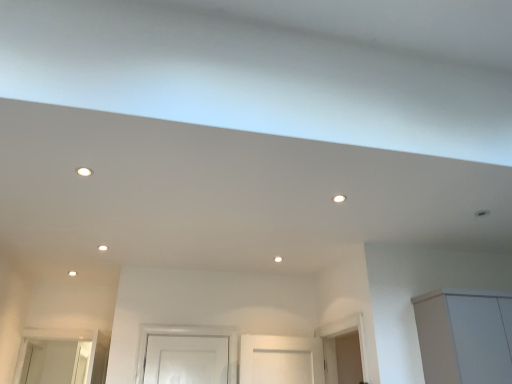
Question: From a real-world perspective, is white glossy light fixture at upper left, the second lighting in the bottom-to-top sequence, over matte white light fixture at center, which ranks as the 1th lighting in back-to-front order?

Choices:
 (A) no
 (B) yes

Answer: (B)

Question: Can you confirm if white glossy light fixture at upper left, which appears as the 1th lighting when viewed from the front, is taller than matte white light fixture at center, which is the 1th lighting from right to left?

Choices:
 (A) yes
 (B) no

Answer: (B)

Question: Does white glossy light fixture at upper left, marked as the first lighting in a top-to-bottom arrangement, lie behind matte white light fixture at center, positioned as the first lighting in bottom-to-top order?

Choices:
 (A) yes
 (B) no

Answer: (B)

Question: From a real-world perspective, is white glossy light fixture at upper left, which appears as the 1th lighting when viewed from the front, beneath matte white light fixture at center, the second lighting viewed from the top?

Choices:
 (A) yes
 (B) no

Answer: (B)

Question: Can you confirm if white glossy light fixture at upper left, which appears as the 1th lighting when viewed from the front, is shorter than matte white light fixture at center, which is the 2th lighting in front-to-back order?

Choices:
 (A) yes
 (B) no

Answer: (A)

Question: Can you confirm if white glossy light fixture at upper left, marked as the first lighting in a top-to-bottom arrangement, is wider than matte white light fixture at center, which is the 2th lighting in front-to-back order?

Choices:
 (A) no
 (B) yes

Answer: (B)

Question: From a real-world perspective, is matte white light fixture at center, which is the 1th lighting from right to left, on top of white matte cabinet at lower right?

Choices:
 (A) no
 (B) yes

Answer: (B)

Question: From the image's perspective, is matte white light fixture at center, positioned as the first lighting in bottom-to-top order, located beneath white matte cabinet at lower right?

Choices:
 (A) no
 (B) yes

Answer: (A)

Question: Is matte white light fixture at center, which is the 2th lighting in front-to-back order, surrounding white matte cabinet at lower right?

Choices:
 (A) no
 (B) yes

Answer: (A)

Question: Can you confirm if matte white light fixture at center, placed as the 2th lighting when sorted from left to right, is bigger than white matte cabinet at lower right?

Choices:
 (A) yes
 (B) no

Answer: (B)

Question: Are matte white light fixture at center, positioned as the first lighting in bottom-to-top order, and white matte cabinet at lower right making contact?

Choices:
 (A) no
 (B) yes

Answer: (A)

Question: Is matte white light fixture at center, positioned as the first lighting in bottom-to-top order, facing away from white matte cabinet at lower right?

Choices:
 (A) yes
 (B) no

Answer: (B)

Question: Can you confirm if white matte cabinet at lower right is bigger than white glossy light fixture at upper left, placed as the 2th lighting when sorted from right to left?

Choices:
 (A) yes
 (B) no

Answer: (A)